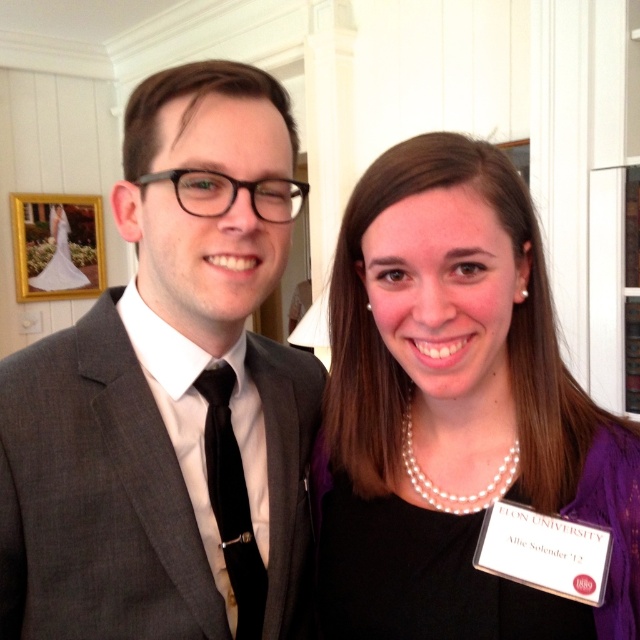
Is matte gray suit at left positioned behind white satin dress at upper left?

No, matte gray suit at left is in front of white satin dress at upper left.

Who is positioned more to the left, matte gray suit at left or white satin dress at upper left?

From the viewer's perspective, white satin dress at upper left appears more on the left side.

Which is in front, point (60, 618) or point (80, 285)?

Point (60, 618)

Where is `matte gray suit at left`? matte gray suit at left is located at coordinates (170, 394).

Is gold-framed picture at upper left bigger than black silk tie at left?

Correct, gold-framed picture at upper left is larger in size than black silk tie at left.

Is gold-framed picture at upper left wider than black silk tie at left?

Correct, the width of gold-framed picture at upper left exceeds that of black silk tie at left.

Describe the element at coordinates (58, 244) in the screenshot. This screenshot has height=640, width=640. I see `gold-framed picture at upper left` at that location.

I want to click on gold-framed picture at upper left, so click(58, 244).

Is matte gray suit at left shorter than pearl necklace at center?

In fact, matte gray suit at left may be taller than pearl necklace at center.

Who is more distant from viewer, (x=106, y=388) or (x=493, y=428)?

The point (x=493, y=428) is behind.

Identify the location of matte gray suit at left. (170, 394).